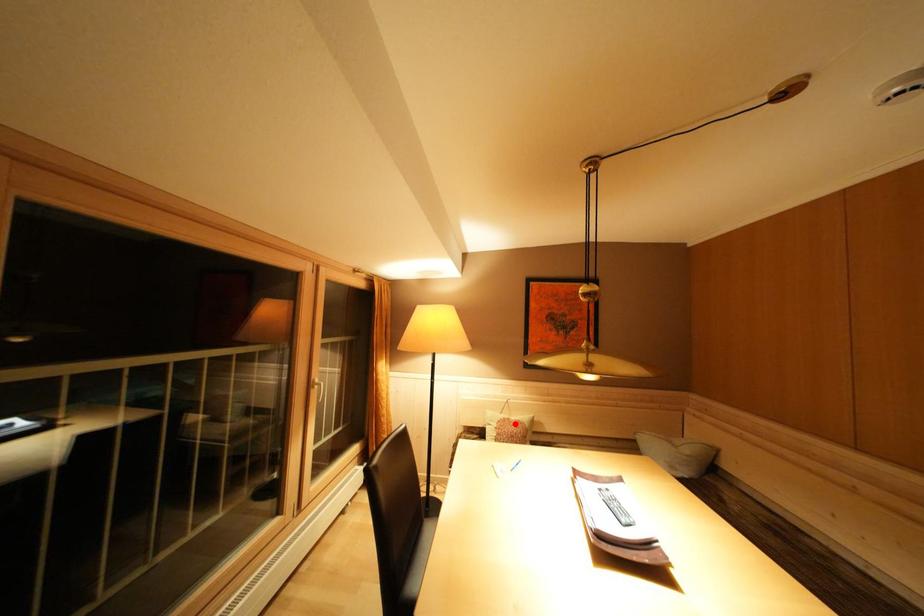
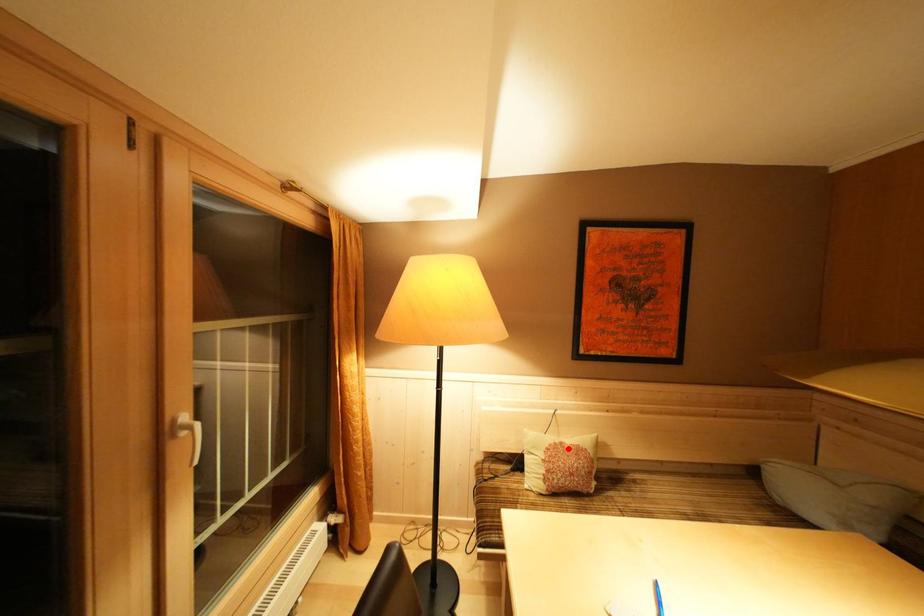
I am providing you with two images of the same scene from different viewpoints. A red point is marked on the first image and another point is marked on the second image. Is the red point in image1 aligned with the point shown in image2?

Yes